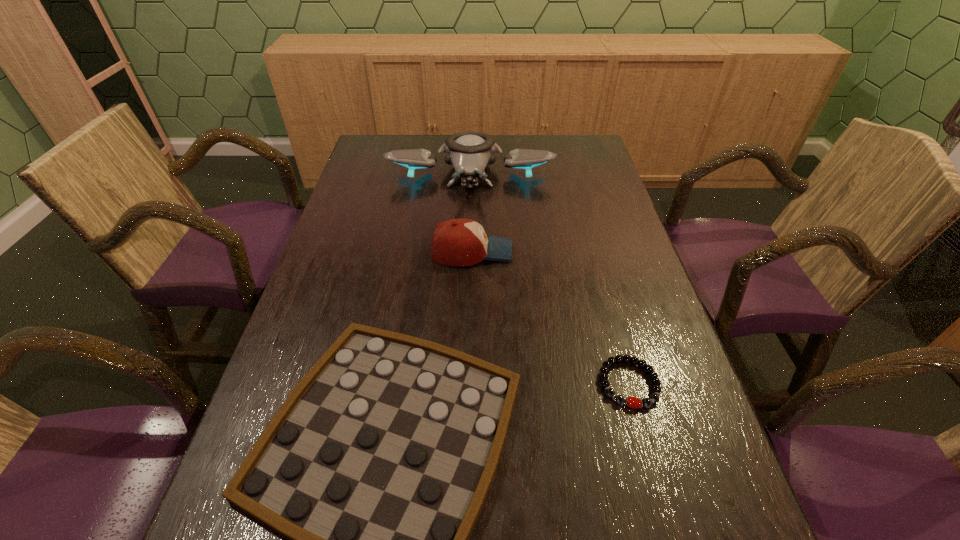
Locate an element on the screen. The image size is (960, 540). the farthest object is located at coordinates (469, 152).

What are the coordinates of `the second farthest object` in the screenshot? It's located at (457, 242).

Locate an element on the screen. the shortest object is located at coordinates (632, 402).

At what (x,y) coordinates should I click in order to perform the action: click on free space located 0.310m on the front-facing side of the farthest object. Please return your answer as a coordinate pair (x, y). This screenshot has height=540, width=960. Looking at the image, I should click on (468, 271).

Where is `vacant area located 0.280m on the front-facing side of the third nearest object`? This screenshot has height=540, width=960. vacant area located 0.280m on the front-facing side of the third nearest object is located at coordinates (619, 251).

At what (x,y) coordinates should I click in order to perform the action: click on vacant area situated on the back of the shortest object. Please return your answer as a coordinate pair (x, y). Looking at the image, I should click on (602, 289).

Locate an element on the screen. This screenshot has width=960, height=540. object present at the far edge is located at coordinates (469, 152).

Identify the location of object present at the left edge. pyautogui.click(x=469, y=152).

This screenshot has width=960, height=540. I want to click on object located at the right edge, so click(x=632, y=402).

Where is `object present at the far left corner`? object present at the far left corner is located at coordinates (469, 152).